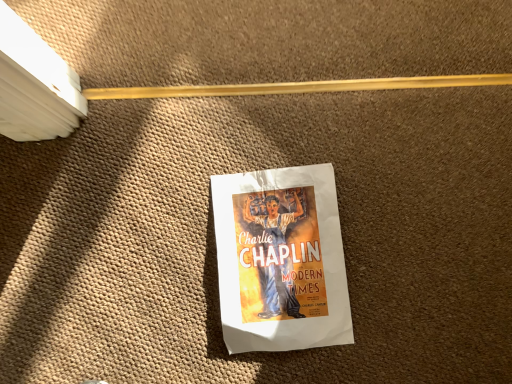
Measure the distance between point (x=295, y=187) and camera.

A distance of 28.35 inches exists between point (x=295, y=187) and camera.

The width and height of the screenshot is (512, 384). What do you see at coordinates (280, 260) in the screenshot?
I see `white paper poster at center` at bounding box center [280, 260].

Where is `white paper poster at center`? Image resolution: width=512 pixels, height=384 pixels. white paper poster at center is located at coordinates (280, 260).

This screenshot has height=384, width=512. Find the location of `white paper poster at center`. white paper poster at center is located at coordinates (280, 260).